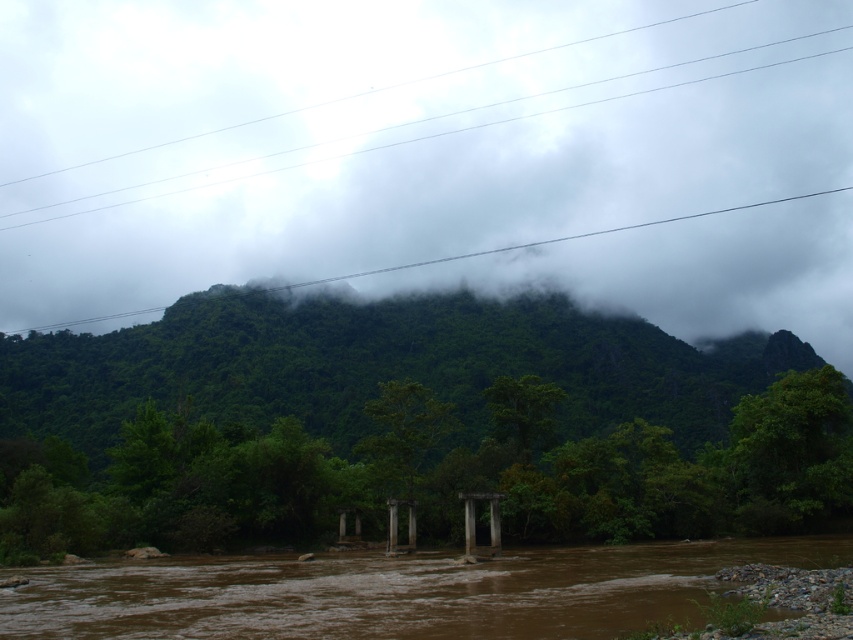
Is green leafy hillside at upper center bigger than brown muddy water at center?

Yes.

Who is more forward, (339, 152) or (616, 630)?

Positioned in front is point (616, 630).

Where is `green leafy hillside at upper center`? The height and width of the screenshot is (640, 853). green leafy hillside at upper center is located at coordinates (445, 168).